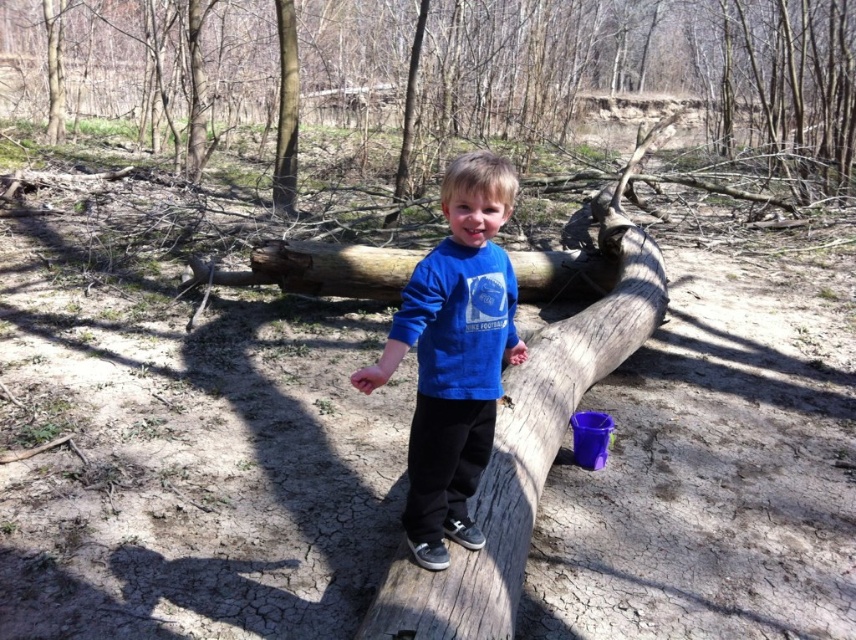
Is point (415, 48) in front of point (459, 378)?

No, (415, 48) is further to viewer.

Find the location of a particular element. This screenshot has height=640, width=856. smooth brown log at center is located at coordinates (593, 68).